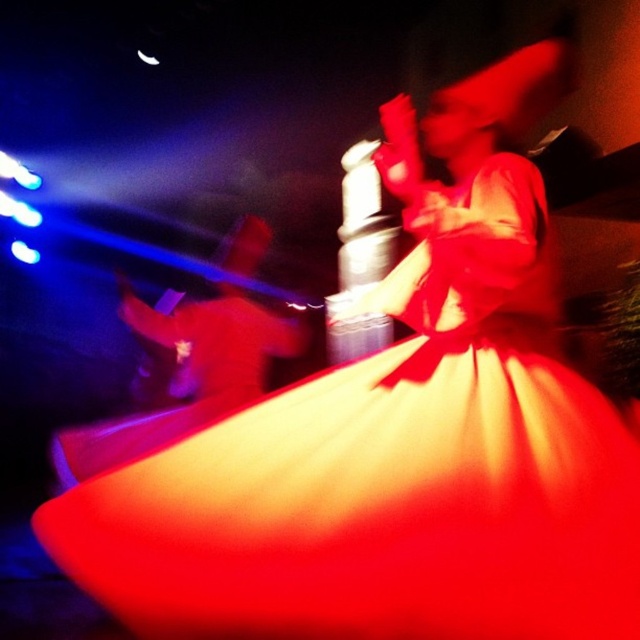
Question: Does shiny red fabric dress at center have a lesser width compared to matte white guitar at left?

Choices:
 (A) yes
 (B) no

Answer: (B)

Question: Which point is farther to the camera?

Choices:
 (A) matte white guitar at left
 (B) shiny red fabric dress at center

Answer: (A)

Question: Among these objects, which one is farthest from the camera?

Choices:
 (A) matte white guitar at left
 (B) shiny red fabric dress at center

Answer: (A)

Question: Can you confirm if shiny red fabric dress at center is positioned to the right of matte white guitar at left?

Choices:
 (A) no
 (B) yes

Answer: (B)

Question: Does shiny red fabric dress at center appear on the left side of matte white guitar at left?

Choices:
 (A) yes
 (B) no

Answer: (B)